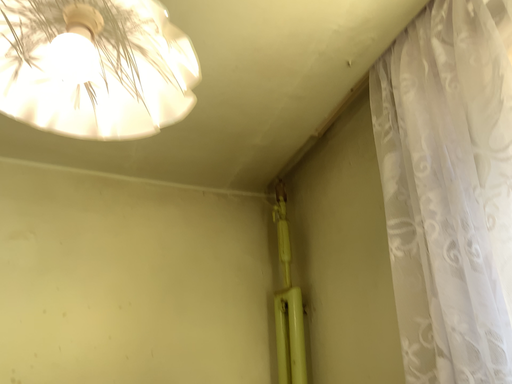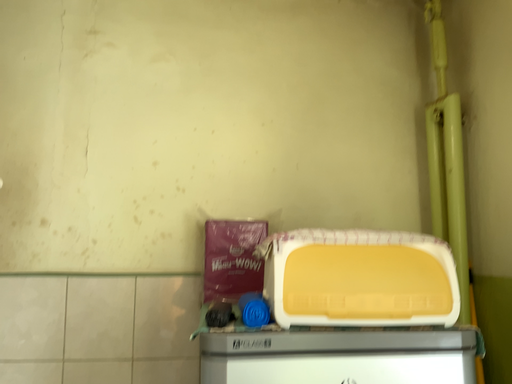
Question: Which way did the camera rotate in the video?

Choices:
 (A) rotated downward
 (B) rotated upward

Answer: (A)